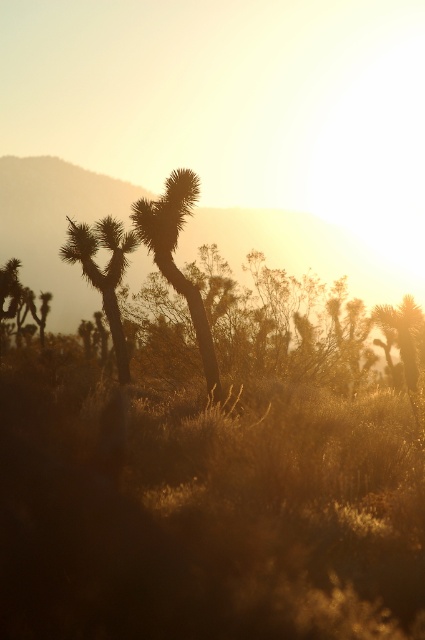
Question: From the image, what is the correct spatial relationship of brown spiky cactus at center in relation to silhouetted spiky cactus at center?

Choices:
 (A) left
 (B) right

Answer: (B)

Question: Does brown spiky cactus at center appear on the right side of silhouetted spiky cactus at center?

Choices:
 (A) no
 (B) yes

Answer: (B)

Question: Does brown spiky cactus at center appear on the left side of silhouetted spiky cactus at center?

Choices:
 (A) no
 (B) yes

Answer: (A)

Question: Among these objects, which one is nearest to the camera?

Choices:
 (A) silhouetted spiky cactus at center
 (B) brown spiky cactus at center

Answer: (B)

Question: Which object is closer to the camera taking this photo?

Choices:
 (A) brown spiky cactus at center
 (B) silhouetted spiky cactus at center

Answer: (A)

Question: Which of the following is the closest to the observer?

Choices:
 (A) (183, 195)
 (B) (116, 278)

Answer: (A)